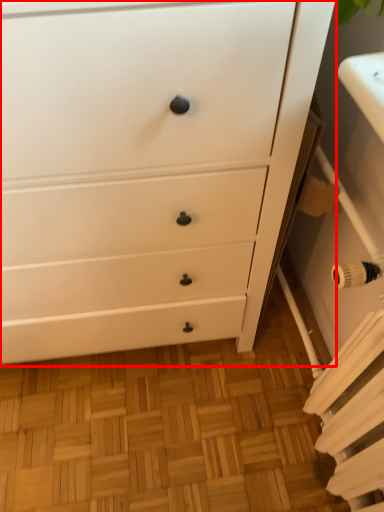
Question: Where is chest of drawers (annotated by the red box) located in relation to radiator in the image?

Choices:
 (A) left
 (B) right

Answer: (A)